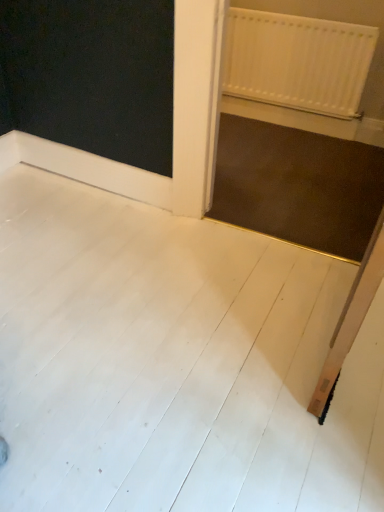
What is the approximate width of white plastic radiator at upper right?

4.87 centimeters.

Locate an element on the screen. white plastic radiator at upper right is located at coordinates (297, 61).

What do you see at coordinates (297, 61) in the screenshot?
I see `white plastic radiator at upper right` at bounding box center [297, 61].

Locate an element on the screen. Image resolution: width=384 pixels, height=512 pixels. white plastic radiator at upper right is located at coordinates (297, 61).